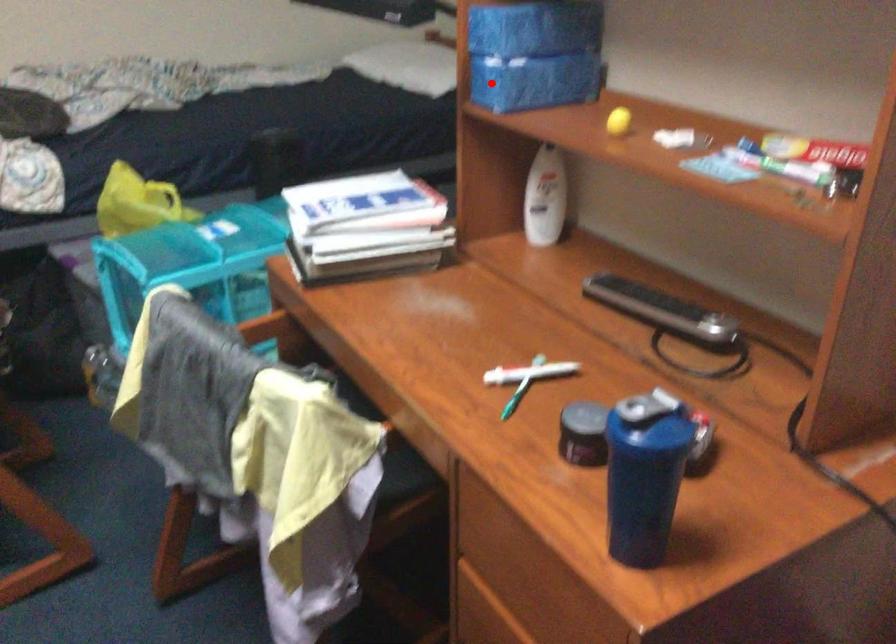
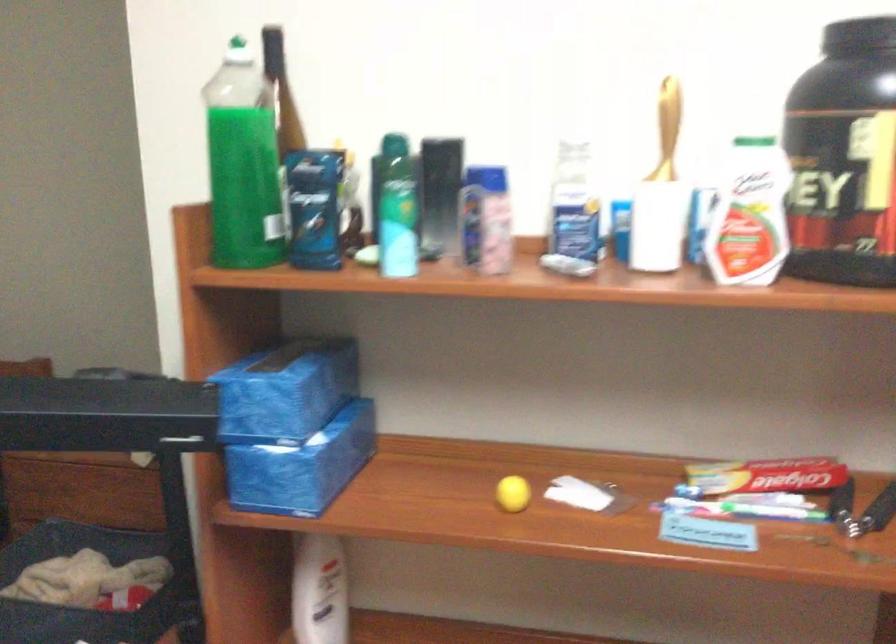
Question: A red point is marked in image1. In image2, is the corresponding 3D point closer to the camera or farther? Reply with the corresponding letter.

Choices:
 (A) The corresponding 3D point is closer.
 (B) The corresponding 3D point is farther.

Answer: (A)